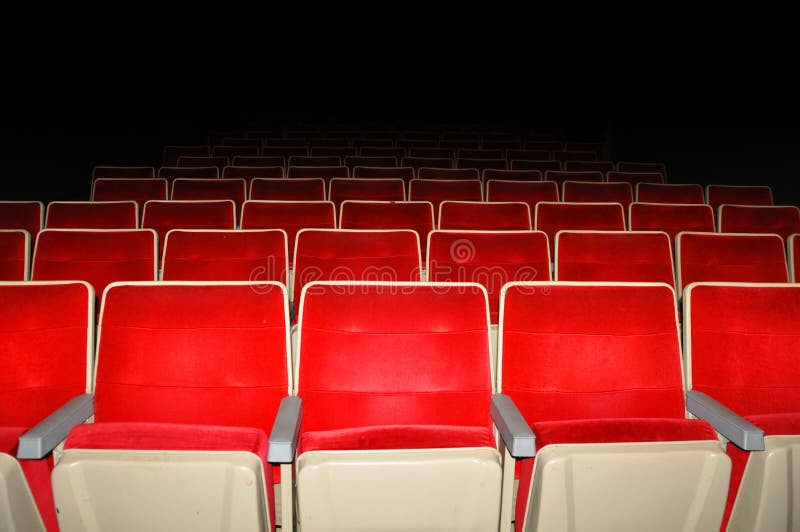
Image resolution: width=800 pixels, height=532 pixels. In order to click on seats in row second from front in this screenshot , I will do `click(726, 268)`, `click(634, 265)`, `click(468, 274)`, `click(400, 255)`, `click(250, 268)`, `click(134, 253)`, `click(16, 261)`.